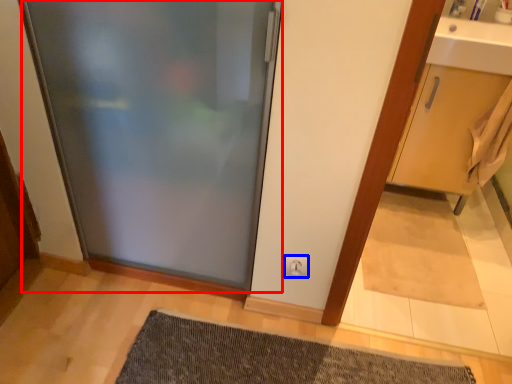
Question: Which object is closer to the camera taking this photo, door (highlighted by a red box) or electric outlet (highlighted by a blue box)?

Choices:
 (A) door
 (B) electric outlet

Answer: (A)